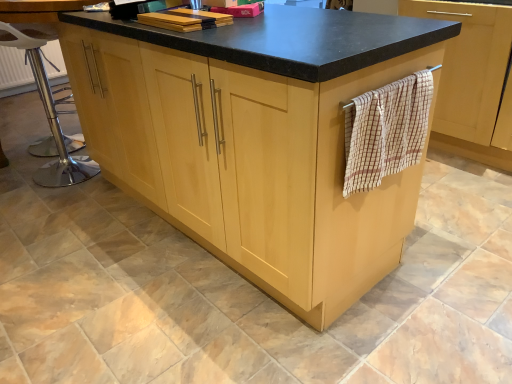
Question: Is polished chrome bar stool at left shorter than beige checkered towel at right?

Choices:
 (A) no
 (B) yes

Answer: (A)

Question: Is polished chrome bar stool at left next to beige checkered towel at right?

Choices:
 (A) no
 (B) yes

Answer: (A)

Question: Is the depth of polished chrome bar stool at left greater than that of beige checkered towel at right?

Choices:
 (A) yes
 (B) no

Answer: (A)

Question: Is polished chrome bar stool at left at the right side of beige checkered towel at right?

Choices:
 (A) no
 (B) yes

Answer: (A)

Question: Considering the relative positions of polished chrome bar stool at left and beige checkered towel at right in the image provided, is polished chrome bar stool at left in front of beige checkered towel at right?

Choices:
 (A) yes
 (B) no

Answer: (B)

Question: From the image's perspective, is polished chrome bar stool at left on beige checkered towel at right?

Choices:
 (A) yes
 (B) no

Answer: (A)

Question: Would you say light wood cupboard at center contains beige checkered towel at right?

Choices:
 (A) no
 (B) yes

Answer: (A)

Question: From the image's perspective, is light wood cupboard at center over beige checkered towel at right?

Choices:
 (A) yes
 (B) no

Answer: (A)

Question: Can you confirm if light wood cupboard at center is positioned to the right of beige checkered towel at right?

Choices:
 (A) yes
 (B) no

Answer: (B)

Question: Is light wood cupboard at center positioned before beige checkered towel at right?

Choices:
 (A) yes
 (B) no

Answer: (A)

Question: Can you confirm if light wood cupboard at center is taller than beige checkered towel at right?

Choices:
 (A) no
 (B) yes

Answer: (B)

Question: Is light wood cupboard at center smaller than beige checkered towel at right?

Choices:
 (A) yes
 (B) no

Answer: (B)

Question: Can you confirm if wooden towel rack at right is bigger than beige checkered towel at right?

Choices:
 (A) no
 (B) yes

Answer: (B)